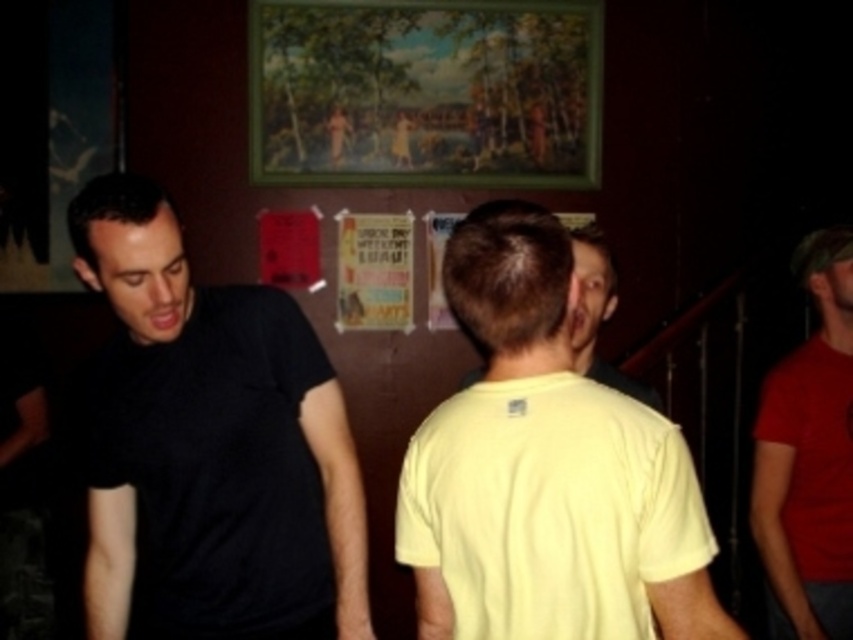
Is black matte t-shirt at left thinner than yellow matte shirt at center?

No.

Which is behind, point (103, 515) or point (595, 289)?

Positioned behind is point (595, 289).

The width and height of the screenshot is (853, 640). I want to click on black matte t-shirt at left, so click(212, 442).

Does black matte t-shirt at left appear on the right side of yellow matte t-shirt at center?

In fact, black matte t-shirt at left is to the left of yellow matte t-shirt at center.

Who is more forward, (311, 410) or (537, 486)?

Point (537, 486) is in front.

I want to click on black matte t-shirt at left, so click(x=212, y=442).

Between yellow matte t-shirt at center and red matte t-shirt at right, which one appears on the left side from the viewer's perspective?

yellow matte t-shirt at center

The width and height of the screenshot is (853, 640). I want to click on yellow matte t-shirt at center, so click(x=546, y=472).

Where is `yellow matte t-shirt at center`? yellow matte t-shirt at center is located at coordinates (546, 472).